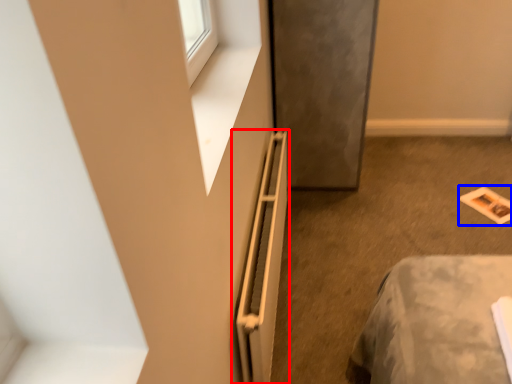
Question: Which of the following is the closest to the observer, radiator (highlighted by a red box) or magazine (highlighted by a blue box)?

Choices:
 (A) radiator
 (B) magazine

Answer: (A)